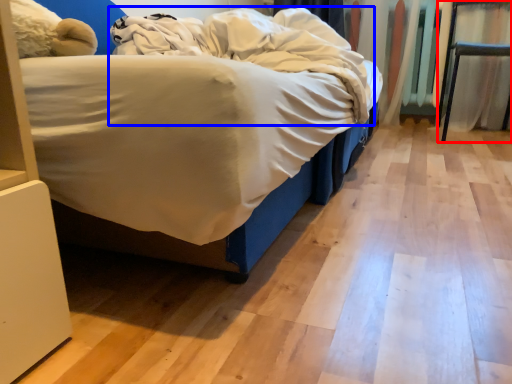
Question: Among these objects, which one is nearest to the camera, furniture (highlighted by a red box) or blanket (highlighted by a blue box)?

Choices:
 (A) furniture
 (B) blanket

Answer: (B)